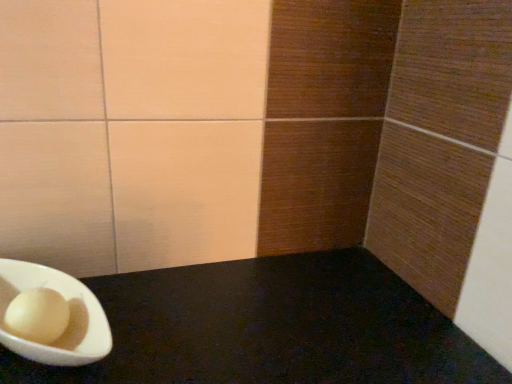
Question: Should I look upward or downward to see white matte bowl at lower left?

Choices:
 (A) down
 (B) up

Answer: (A)